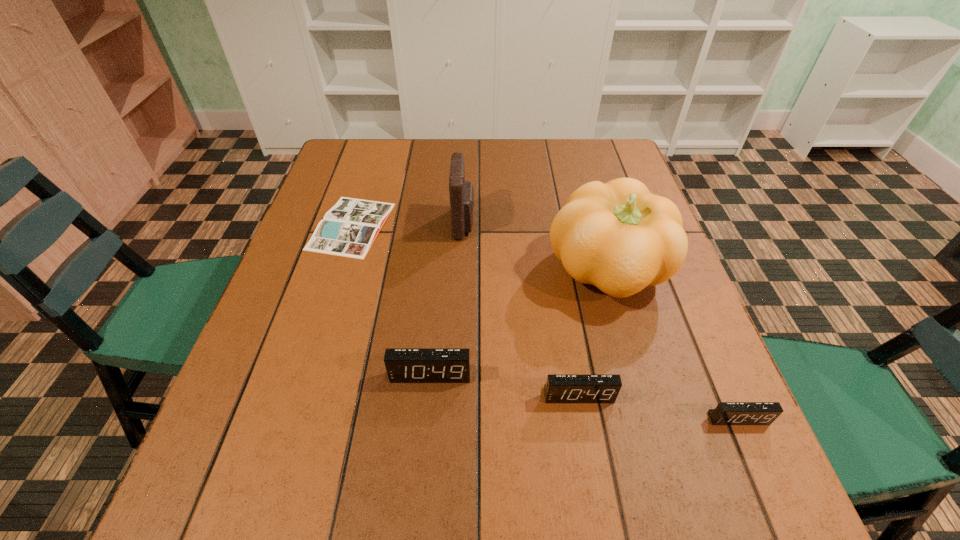
In the current image, all alarm clocks are evenly spaced. To maintain this equal spacing, where should an additional alarm clock be placed on the left? Please point out a free spot. Please provide its 2D coordinates. Your answer should be formatted as a tuple, i.e. [(x, y)], where the tuple contains the x and y coordinates of a point satisfying the conditions above.

[(293, 354)]